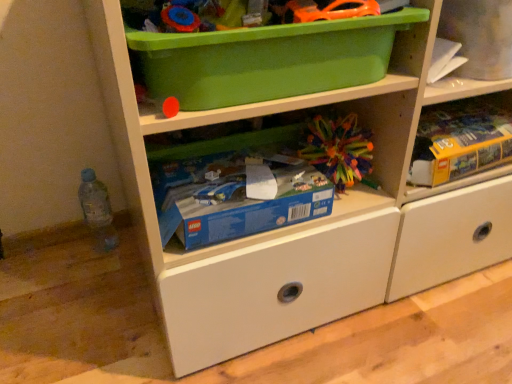
Where is `free spot to the right of translucent plastic bottle at lower left`? free spot to the right of translucent plastic bottle at lower left is located at coordinates (134, 249).